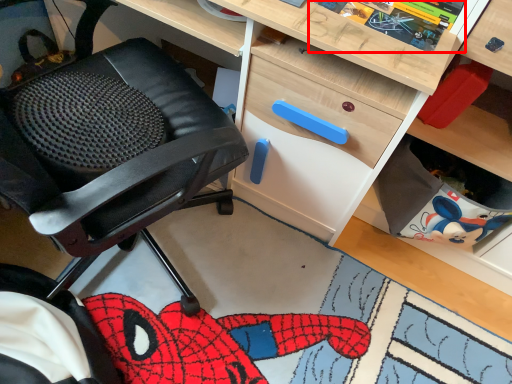
Question: Where is comic book (annotated by the red box) located in relation to chair in the image?

Choices:
 (A) right
 (B) left

Answer: (A)